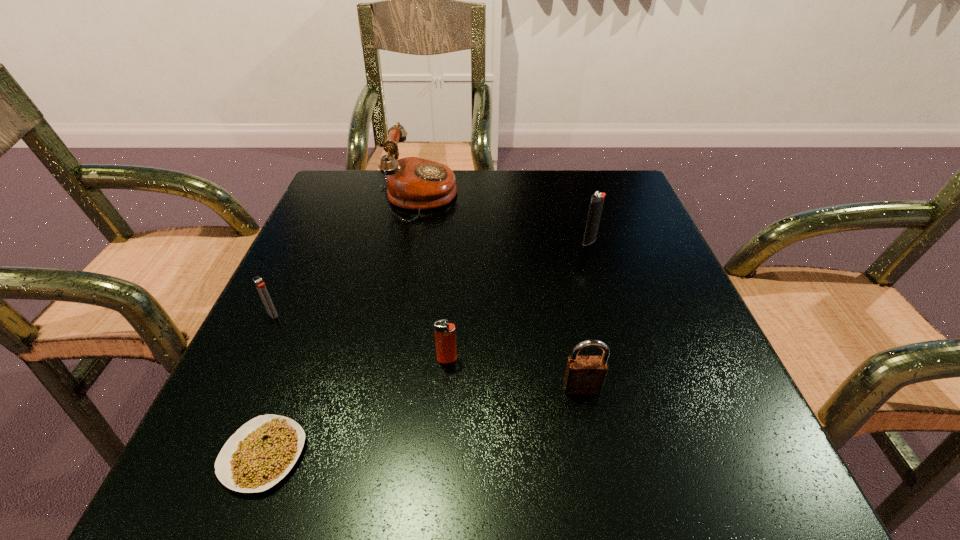
Find the location of `telephone`. telephone is located at coordinates (414, 183).

Image resolution: width=960 pixels, height=540 pixels. I want to click on the tallest object, so [x=414, y=183].

The width and height of the screenshot is (960, 540). Find the location of `the rightmost igniter`. the rightmost igniter is located at coordinates (596, 204).

Where is `the farthest igniter`? The height and width of the screenshot is (540, 960). the farthest igniter is located at coordinates (596, 204).

Locate an element on the screen. the second object from right to left is located at coordinates (584, 375).

The width and height of the screenshot is (960, 540). Find the location of `the fifth farthest object`. the fifth farthest object is located at coordinates (584, 375).

This screenshot has width=960, height=540. I want to click on the second igniter from right to left, so click(x=445, y=336).

Where is `the fourth farthest object`? the fourth farthest object is located at coordinates (445, 336).

Locate an element on the screen. the second farthest igniter is located at coordinates (260, 285).

This screenshot has height=540, width=960. I want to click on the leftmost object, so click(x=260, y=285).